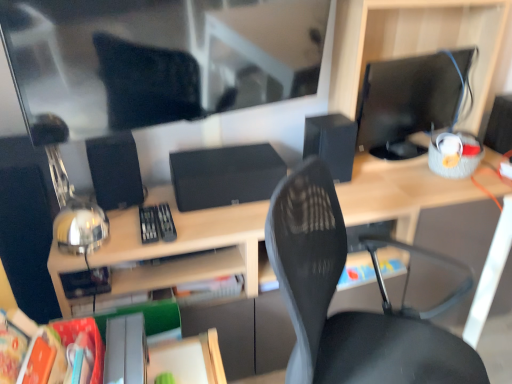
Question: From a real-world perspective, is black matte speaker at right, positioned as the 3th speaker in left-to-right order, below hardcover book at center, the 1th paperback book viewed from the back?

Choices:
 (A) yes
 (B) no

Answer: (B)

Question: Is black matte speaker at right, positioned as the 3th speaker in left-to-right order, next to hardcover book at center, marked as the second paperback book in a front-to-back arrangement, and touching it?

Choices:
 (A) yes
 (B) no

Answer: (B)

Question: Is black matte speaker at right, acting as the 1th speaker starting from the right, positioned before hardcover book at center, positioned as the second paperback book in left-to-right order?

Choices:
 (A) yes
 (B) no

Answer: (B)

Question: Considering the relative positions of black matte speaker at right, positioned as the 3th speaker in left-to-right order, and hardcover book at center, marked as the second paperback book in a front-to-back arrangement, in the image provided, is black matte speaker at right, positioned as the 3th speaker in left-to-right order, behind hardcover book at center, marked as the second paperback book in a front-to-back arrangement,?

Choices:
 (A) no
 (B) yes

Answer: (B)

Question: Is black matte speaker at right, acting as the 1th speaker starting from the right, completely or partially outside of hardcover book at center, the 1th paperback book viewed from the back?

Choices:
 (A) yes
 (B) no

Answer: (A)

Question: Is orange matte paper at lower left, the first paperback book viewed from the left, inside or outside of black matte speaker at left, the third speaker positioned from the right?

Choices:
 (A) outside
 (B) inside

Answer: (A)

Question: Is orange matte paper at lower left, the 1th paperback book positioned from the front, taller or shorter than black matte speaker at left, which is counted as the 1th speaker, starting from the left?

Choices:
 (A) tall
 (B) short

Answer: (B)

Question: In the image, is orange matte paper at lower left, the 1th paperback book positioned from the front, positioned in front of or behind black matte speaker at left, the third speaker positioned from the right?

Choices:
 (A) front
 (B) behind

Answer: (A)

Question: From the image's perspective, is orange matte paper at lower left, the 1th paperback book positioned from the front, above or below black matte speaker at left, the third speaker positioned from the right?

Choices:
 (A) above
 (B) below

Answer: (B)

Question: Looking at their shapes, would you say black matte speaker at left, which is counted as the 1th speaker, starting from the left, is wider or thinner than matte black monitor at right?

Choices:
 (A) thin
 (B) wide

Answer: (B)

Question: From a real-world perspective, relative to matte black monitor at right, is black matte speaker at left, which is counted as the 1th speaker, starting from the left, vertically above or below?

Choices:
 (A) below
 (B) above

Answer: (A)

Question: Based on their positions, is black matte speaker at left, the third speaker positioned from the right, located to the left or right of matte black monitor at right?

Choices:
 (A) left
 (B) right

Answer: (A)

Question: In terms of height, does black matte speaker at left, the third speaker positioned from the right, look taller or shorter compared to matte black monitor at right?

Choices:
 (A) tall
 (B) short

Answer: (B)

Question: Is black matte speaker at right, positioned as the 3th speaker in left-to-right order, to the left or to the right of orange matte paper at lower left, which ranks as the second paperback book in back-to-front order, in the image?

Choices:
 (A) right
 (B) left

Answer: (A)

Question: Looking at their shapes, would you say black matte speaker at right, positioned as the 3th speaker in left-to-right order, is wider or thinner than orange matte paper at lower left, the 2th paperback book when ordered from right to left?

Choices:
 (A) thin
 (B) wide

Answer: (B)